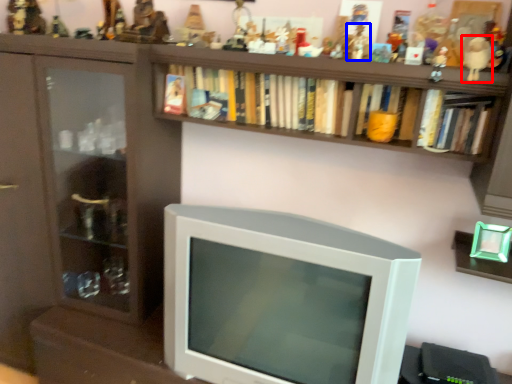
Question: Which object is closer to the camera taking this photo, toy (highlighted by a red box) or toy (highlighted by a blue box)?

Choices:
 (A) toy
 (B) toy

Answer: (A)